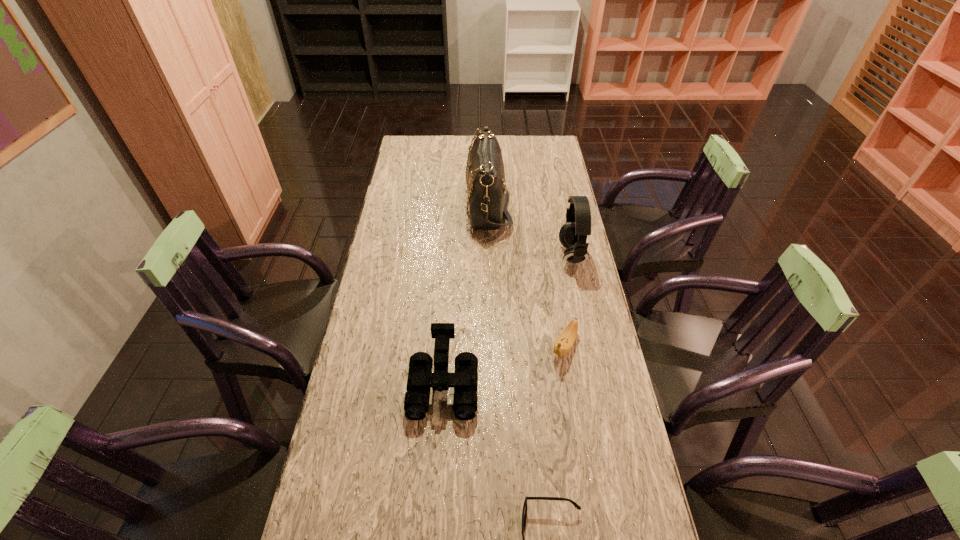
At what (x,y) coordinates should I click in order to perform the action: click on free space that satisfies the following two spatial constraints: 1. at the front of the handbag with chain and zipper; 2. on the front lenses of the binoculars. Please return your answer as a coordinate pair (x, y). The height and width of the screenshot is (540, 960). Looking at the image, I should click on (492, 384).

Identify the location of vacant area in the image that satisfies the following two spatial constraints: 1. on the ear cups of the earphone; 2. on the front lenses of the third tallest object. (599, 384).

The width and height of the screenshot is (960, 540). I want to click on free space that satisfies the following two spatial constraints: 1. on the back side of the banana; 2. at the front of the handbag with chain and zipper, so click(x=541, y=205).